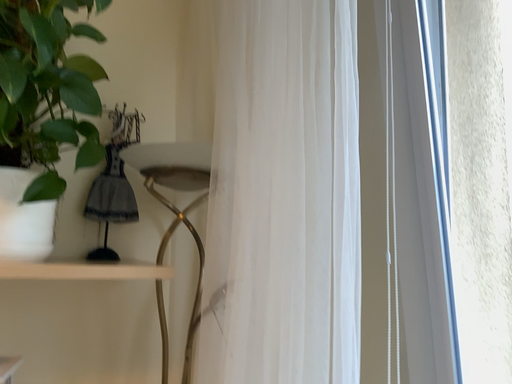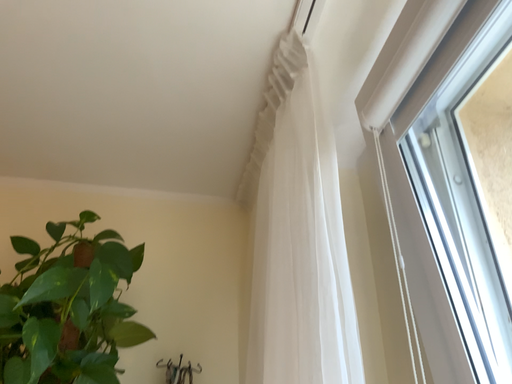
Question: How did the camera likely rotate when shooting the video?

Choices:
 (A) rotated upward
 (B) rotated downward

Answer: (A)